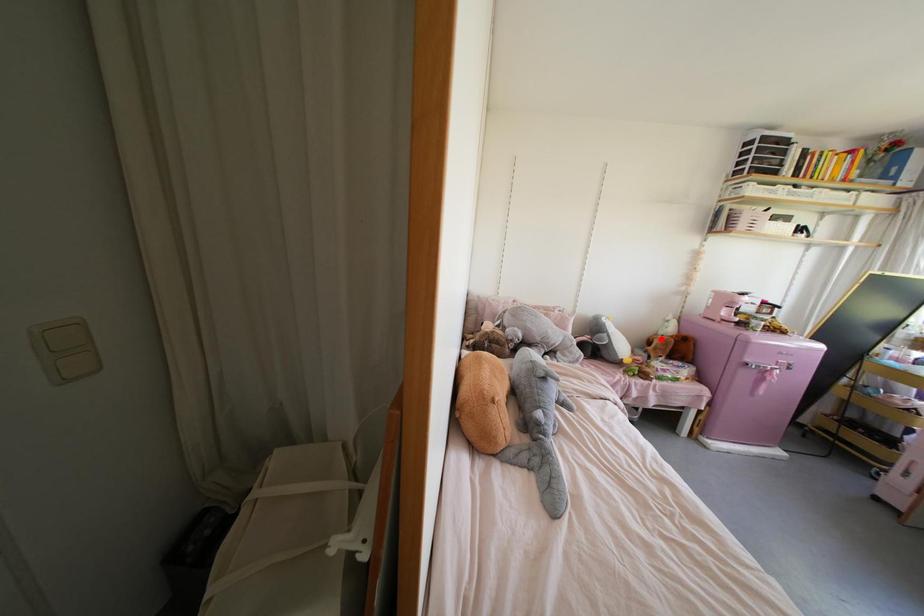
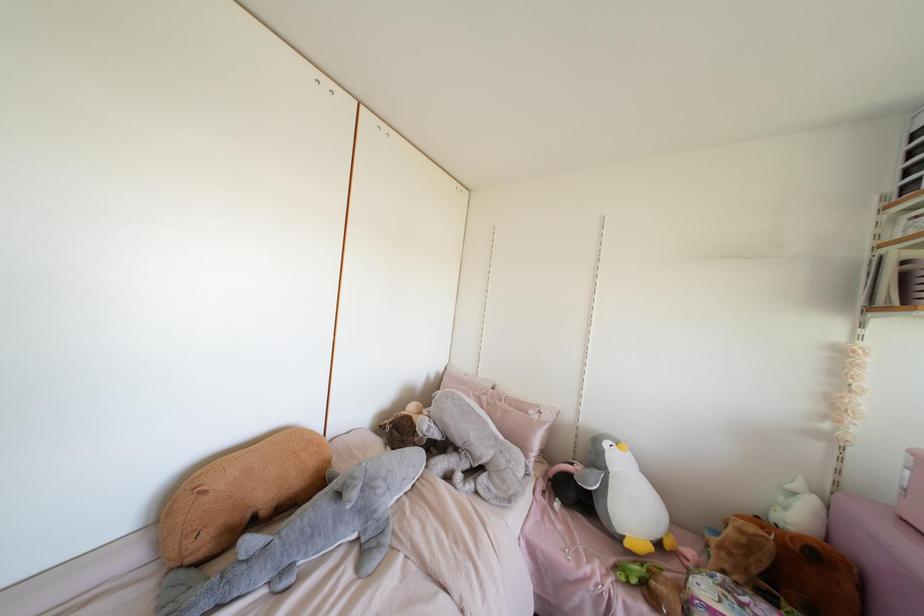
Question: I am providing you with two images of the same scene from different viewpoints. Image1 has a red point marked. In image2, the corresponding 3D location appears at what relative position? Reply with the corresponding letter.

Choices:
 (A) Closer
 (B) Farther

Answer: (B)